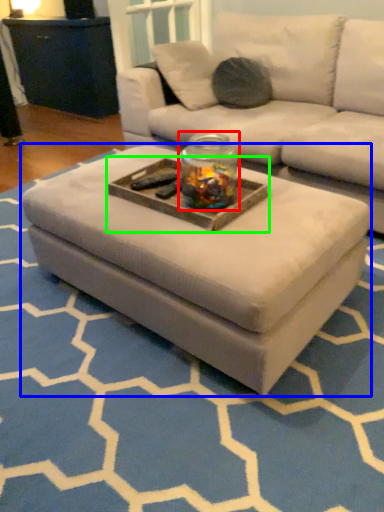
Question: Which object is the closest to the glass jar (highlighted by a red box)? Choose among these: coffee table (highlighted by a blue box) or tray (highlighted by a green box).

Choices:
 (A) coffee table
 (B) tray

Answer: (B)